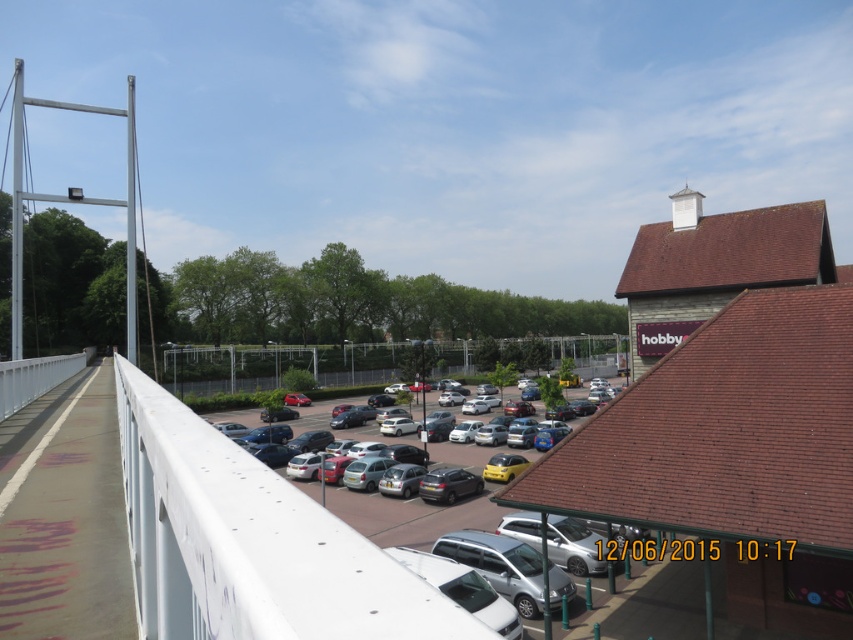
Measure the distance between metallic silver cars at center and camera.

metallic silver cars at center is 53.62 feet from camera.

Image resolution: width=853 pixels, height=640 pixels. What do you see at coordinates (410, 515) in the screenshot? I see `metallic silver cars at center` at bounding box center [410, 515].

Measure the distance between metallic silver cars at center and camera.

A distance of 16.34 meters exists between metallic silver cars at center and camera.

Where is `metallic silver cars at center`? This screenshot has width=853, height=640. metallic silver cars at center is located at coordinates (410, 515).

Consider the image. Can you confirm if silver metallic van at center is positioned to the right of satin silver car at center?

Yes, silver metallic van at center is to the right of satin silver car at center.

Is silver metallic van at center closer to the viewer compared to satin silver car at center?

Yes, it is.

Is point (527, 589) closer to viewer compared to point (440, 481)?

Yes, it is in front of point (440, 481).

At what (x,y) coordinates should I click in order to perform the action: click on silver metallic van at center. Please return your answer as a coordinate pair (x, y). The image size is (853, 640). Looking at the image, I should click on 498,564.

Does silver metallic van at center appear under silver metallic hatchback at center?

No, silver metallic van at center is not below silver metallic hatchback at center.

Who is more forward, (500, 564) or (438, 460)?

Positioned in front is point (500, 564).

I want to click on silver metallic van at center, so click(x=498, y=564).